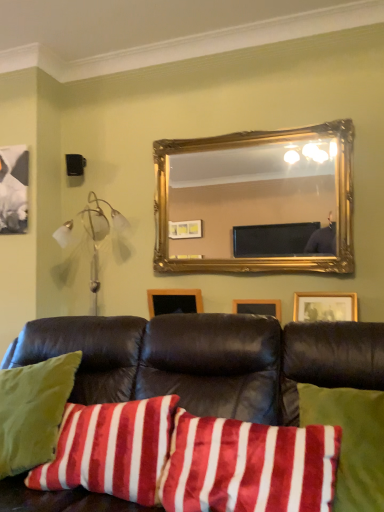
Question: From a real-world perspective, is gold ornate mirror at upper center physically located above or below velvety red and white striped pillow at lower left, arranged as the second pillow when viewed from the right?

Choices:
 (A) above
 (B) below

Answer: (A)

Question: Relative to velvety red and white striped pillow at lower left, which is the 1th pillow in left-to-right order, is gold ornate mirror at upper center in front or behind?

Choices:
 (A) front
 (B) behind

Answer: (B)

Question: Based on their relative distances, which object is nearer to the wooden picture frame at center?

Choices:
 (A) gold ornate mirror at upper center
 (B) velvety red and white striped pillow at lower left, which is the 1th pillow in left-to-right order
 (C) white glass lamp at left
 (D) velvety red pillow at center, the first pillow positioned from the right
 (E) velvet black couch at center

Answer: (C)

Question: Based on their relative distances, which object is farther from the white glass lamp at left?

Choices:
 (A) gold ornate mirror at upper center
 (B) velvety red pillow at center, the first pillow positioned from the right
 (C) velvety red and white striped pillow at lower left, arranged as the second pillow when viewed from the right
 (D) wooden picture frame at center
 (E) velvet black couch at center

Answer: (A)